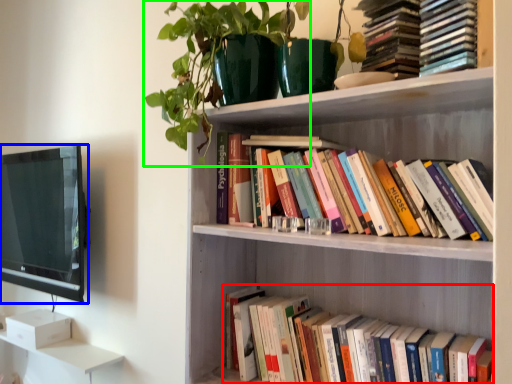
Question: Which object is the farthest from book (highlighted by a red box)? Choose among these: television (highlighted by a blue box) or plant (highlighted by a green box).

Choices:
 (A) television
 (B) plant

Answer: (A)